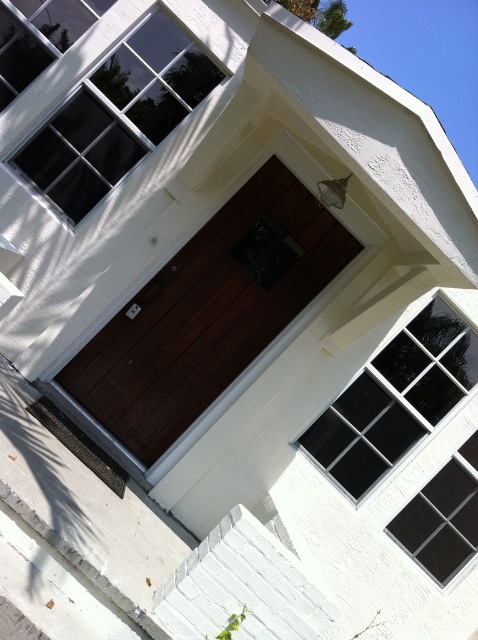
You are a delivery person trying to deliver a package to the house. The package requires a signature, so you need to reach the door. However, there are stairs in front of you. Based on the image, can you determine if the dark wood door at center is large enough to allow you to carry the package through it while navigating the white painted wood stairs at lower center?

The dark wood door at center is bigger than the white painted wood stairs at lower center, so the door is large enough to allow carrying the package through it while navigating the stairs.

You are standing in front of the building and want to enter. Where is the dark wood door at center located relative to the entrance?

The dark wood door at center is located at point [208,310], which is the entrance of the building.

Looking at this image, you are a delivery person with a package that requires a cart to transport. The cart is 2.5 meters long. You need to move it from the white painted wood stairs at lower center to the dark wood door at center. Can the cart fit through the space between the two? Please explain.

The distance between the dark wood door at center and the white painted wood stairs at lower center is 2.56 meters. Since the cart is 2.5 meters long, it can fit through the space as the distance is slightly longer than the cart.